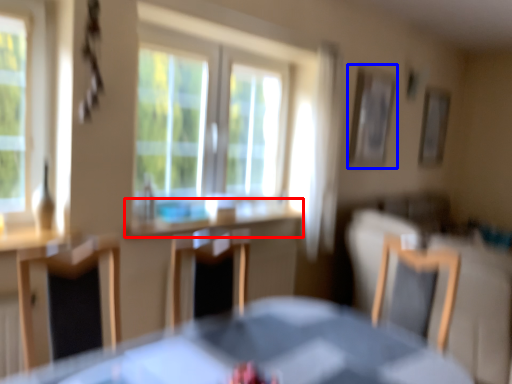
Question: Among these objects, which one is farthest to the camera, counter top (highlighted by a red box) or picture frame (highlighted by a blue box)?

Choices:
 (A) counter top
 (B) picture frame

Answer: (B)